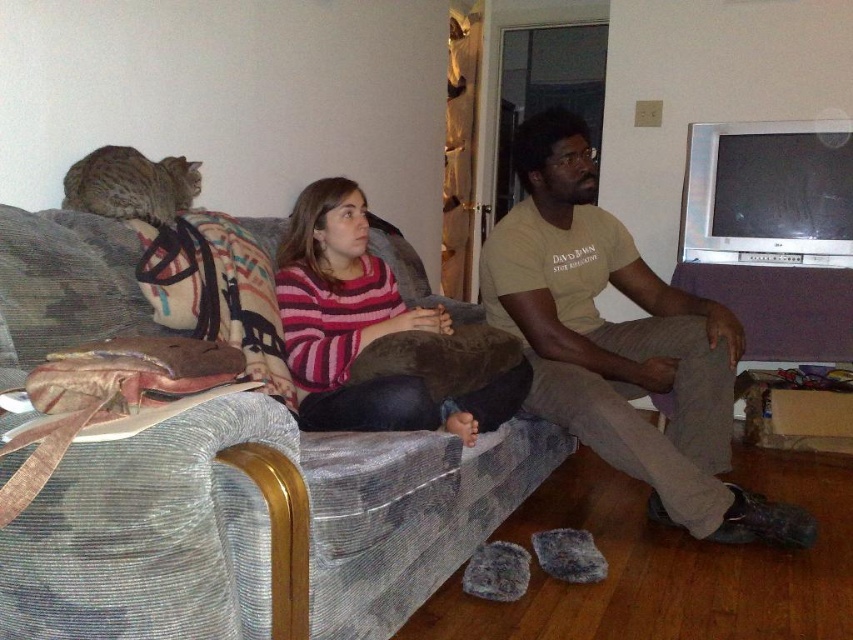
Question: Among these objects, which one is nearest to the camera?

Choices:
 (A) velvet gray couch at center
 (B) striped knit sweater at center

Answer: (A)

Question: Can you confirm if matte khaki t-shirt at center is positioned to the right of striped knit sweater at center?

Choices:
 (A) yes
 (B) no

Answer: (A)

Question: Estimate the real-world distances between objects in this image. Which object is farther from the striped knit sweater at center?

Choices:
 (A) matte khaki t-shirt at center
 (B) velvet gray couch at center

Answer: (A)

Question: Can you confirm if matte khaki t-shirt at center is bigger than striped knit sweater at center?

Choices:
 (A) yes
 (B) no

Answer: (A)

Question: Which point is closer to the camera?

Choices:
 (A) velvet gray couch at center
 (B) matte khaki t-shirt at center

Answer: (A)

Question: Does velvet gray couch at center have a smaller size compared to matte khaki t-shirt at center?

Choices:
 (A) no
 (B) yes

Answer: (A)